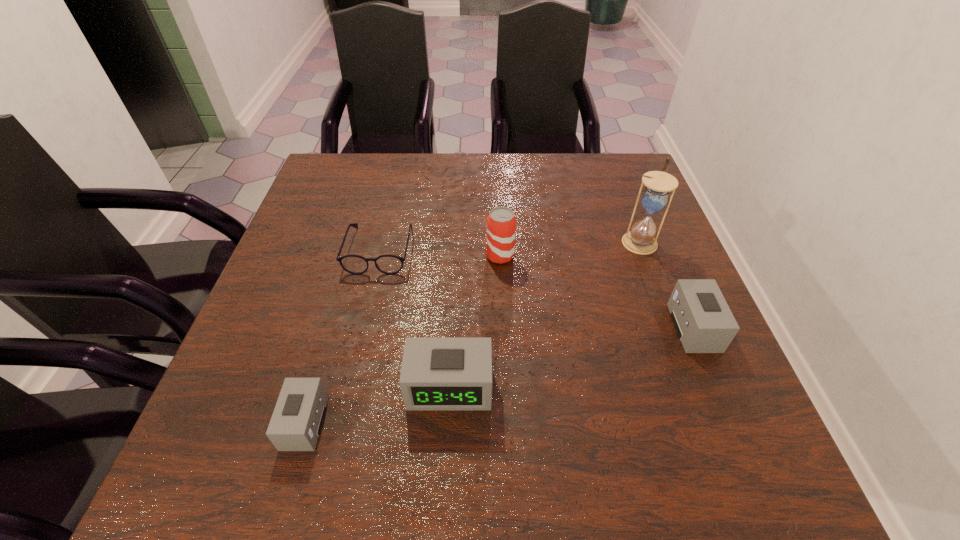
Find the location of a particular element. vacant space at the near edge of the desktop is located at coordinates (373, 399).

The width and height of the screenshot is (960, 540). Find the location of `free space at the left edge of the desktop`. free space at the left edge of the desktop is located at coordinates (286, 330).

In the image, there is a desktop. In order to click on vacant space at the right edge in this screenshot , I will do `click(610, 249)`.

Identify the location of vacant region between the hourglass and the third nearest object. Image resolution: width=960 pixels, height=540 pixels. (666, 285).

Image resolution: width=960 pixels, height=540 pixels. What are the coordinates of `free space between the beer can and the spectacles` in the screenshot? It's located at coord(440,253).

Locate an element on the screen. The image size is (960, 540). free space between the shortest alarm clock and the fourth shortest object is located at coordinates (377, 405).

Find the location of a particular element. The height and width of the screenshot is (540, 960). empty space between the second alarm clock from right to left and the spectacles is located at coordinates (415, 318).

You are a GUI agent. You are given a task and a screenshot of the screen. Output one action in this format:
    pyautogui.click(x=<x>, y=<y>)
    Task: Click on the free point between the second tallest object and the hourglass
    The image size is (960, 540).
    Given the screenshot: What is the action you would take?
    pyautogui.click(x=569, y=248)

The height and width of the screenshot is (540, 960). In order to click on vacant area between the fourth farthest object and the shortest alarm clock in this screenshot , I will do `click(499, 375)`.

At what (x,y) coordinates should I click in order to perform the action: click on free space between the beer can and the spectacles. Please return your answer as a coordinate pair (x, y). The width and height of the screenshot is (960, 540). Looking at the image, I should click on (440, 253).